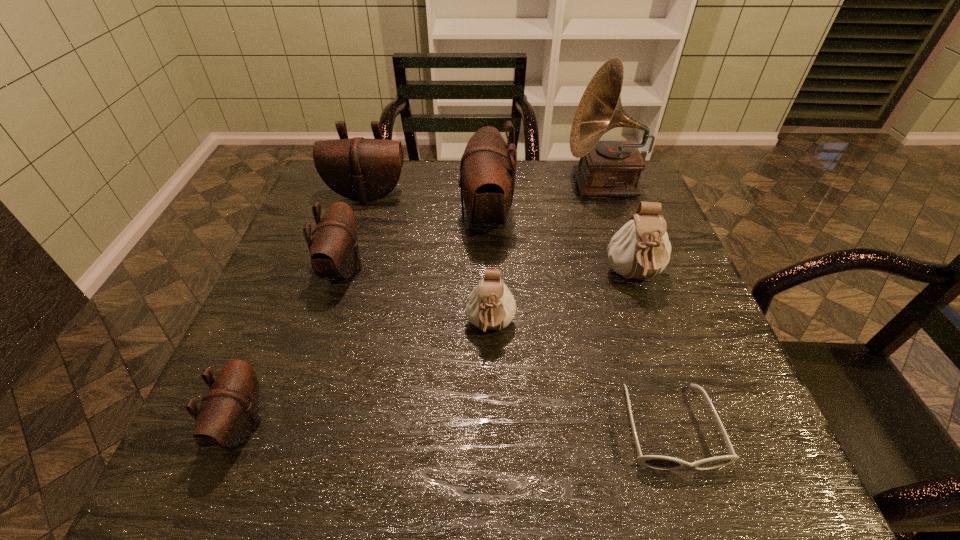
I want to click on sunglasses that is at the right edge, so click(x=657, y=462).

The height and width of the screenshot is (540, 960). Find the location of `object at the far left corner`. object at the far left corner is located at coordinates [361, 169].

Where is `object that is at the near left corner`? The width and height of the screenshot is (960, 540). object that is at the near left corner is located at coordinates (229, 409).

Find the location of a particular element. object that is at the far right corner is located at coordinates (606, 168).

At what (x,y) coordinates should I click in order to perform the action: click on object positioned at the near right corner. Please return your answer as a coordinate pair (x, y). Image resolution: width=960 pixels, height=540 pixels. Looking at the image, I should click on (657, 462).

In the image, there is a desktop. At what (x,y) coordinates should I click in order to perform the action: click on blank space at the far edge. Please return your answer as a coordinate pair (x, y). This screenshot has width=960, height=540. Looking at the image, I should click on (542, 200).

This screenshot has height=540, width=960. In the image, there is a desktop. What are the coordinates of `free space at the near edge` in the screenshot? It's located at (532, 459).

Identify the location of vacant space at the right edge of the desktop. The height and width of the screenshot is (540, 960). (661, 343).

The width and height of the screenshot is (960, 540). I want to click on free space between the tallest object and the farther white pouch, so click(x=618, y=231).

You are a GUI agent. You are given a task and a screenshot of the screen. Output one action in this format:
    pyautogui.click(x=<x>, y=<y>)
    Task: Click on the free spot between the tallest object and the rightmost brown pouch
    This screenshot has height=540, width=960.
    Given the screenshot: What is the action you would take?
    pyautogui.click(x=545, y=200)